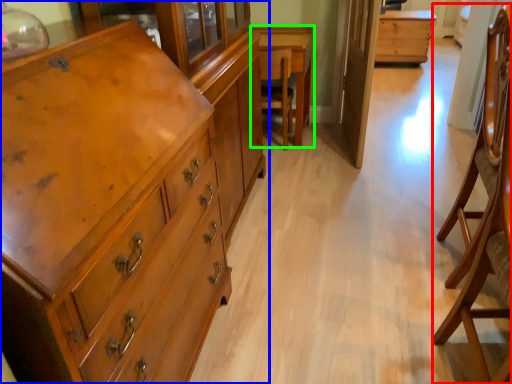
Question: Which object is positioned closest to armchair (highlighted by a red box)? Select from chest of drawers (highlighted by a blue box) and table (highlighted by a green box).

Choices:
 (A) chest of drawers
 (B) table

Answer: (A)